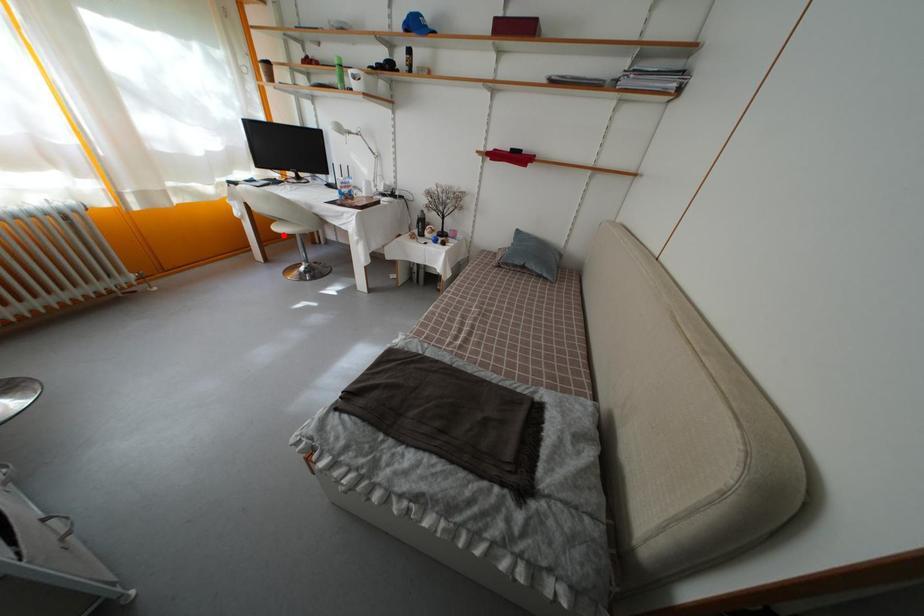
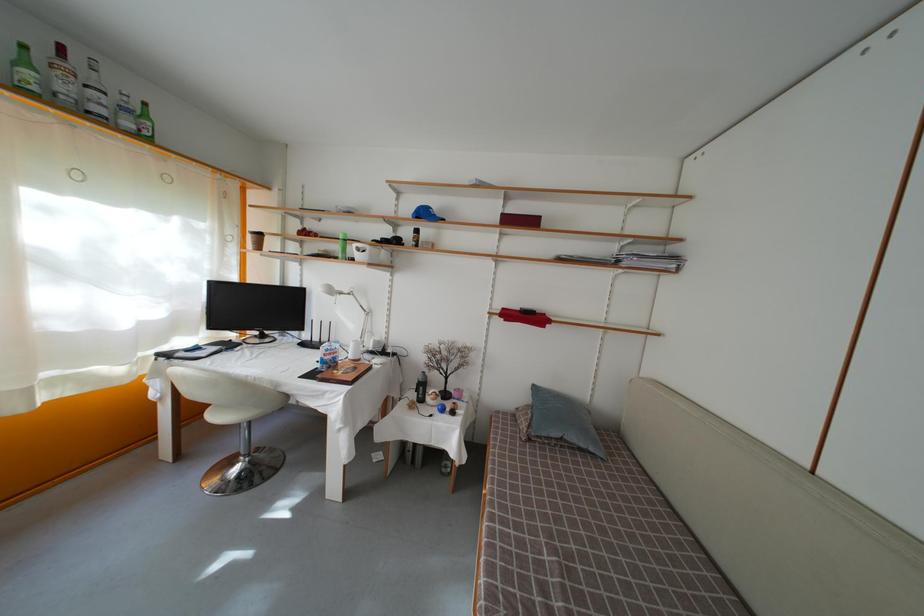
Question: I am providing you with two images of the same scene from different viewpoints. A red point is shown in image1. For the corresponding object point in image2, is it positioned nearer or farther from the camera?

Choices:
 (A) Nearer
 (B) Farther

Answer: (B)